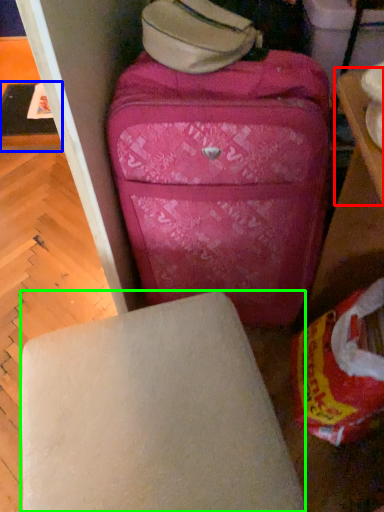
Question: Which is nearer to the table (highlighted by a red box)? table (highlighted by a blue box) or furniture (highlighted by a green box).

Choices:
 (A) table
 (B) furniture

Answer: (B)